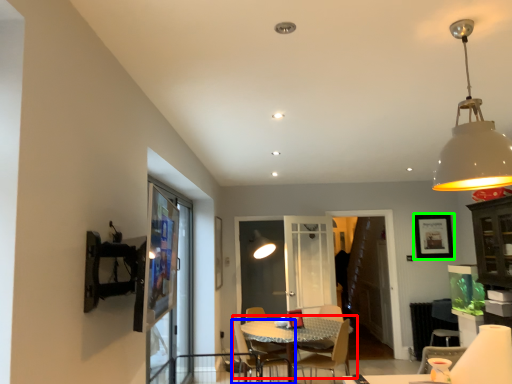
Question: Which is nearer to the table (highlighted by a red box)? chair (highlighted by a blue box) or picture frame (highlighted by a green box).

Choices:
 (A) chair
 (B) picture frame

Answer: (A)